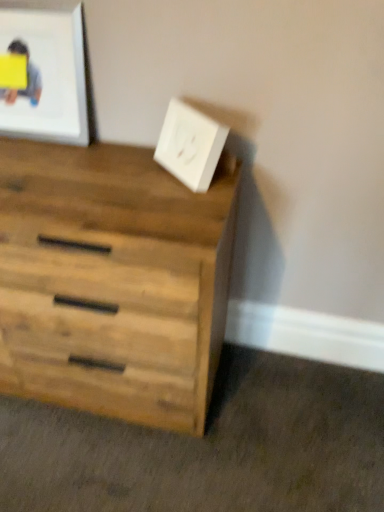
Question: Considering the relative positions of yellow paper at upper left and white matte picture frame at upper left in the image provided, is yellow paper at upper left to the left or to the right of white matte picture frame at upper left?

Choices:
 (A) right
 (B) left

Answer: (B)

Question: From a real-world perspective, is yellow paper at upper left above or below white matte picture frame at upper left?

Choices:
 (A) below
 (B) above

Answer: (A)

Question: Estimate the real-world distances between objects in this image. Which object is farther from the natural wood chest of drawers at lower left?

Choices:
 (A) white matte electric outlet at upper right
 (B) white matte picture frame at upper left
 (C) yellow paper at upper left

Answer: (C)

Question: Which object is the farthest from the white matte picture frame at upper left?

Choices:
 (A) yellow paper at upper left
 (B) white matte electric outlet at upper right
 (C) natural wood chest of drawers at lower left

Answer: (C)